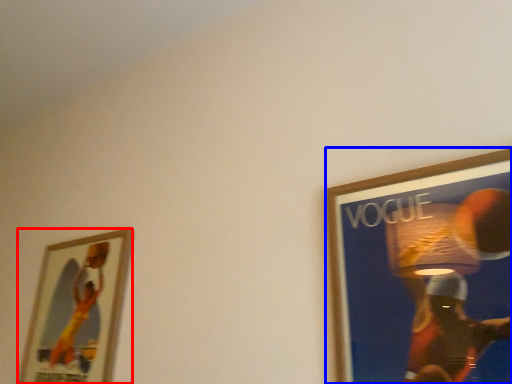
Question: Which of the following is the farthest to the observer, picture frame (highlighted by a red box) or picture frame (highlighted by a blue box)?

Choices:
 (A) picture frame
 (B) picture frame

Answer: (A)